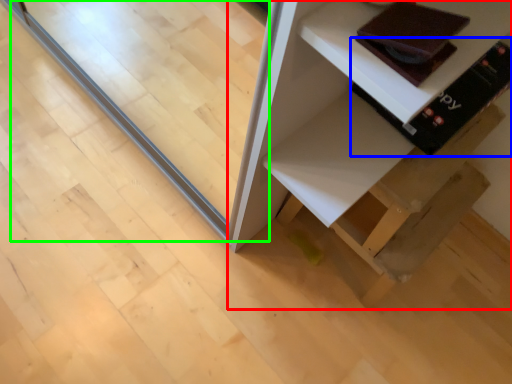
Question: Which object is the farthest from furniture (highlighted by a red box)? Choose among these: book (highlighted by a blue box) or glass door (highlighted by a green box).

Choices:
 (A) book
 (B) glass door

Answer: (B)